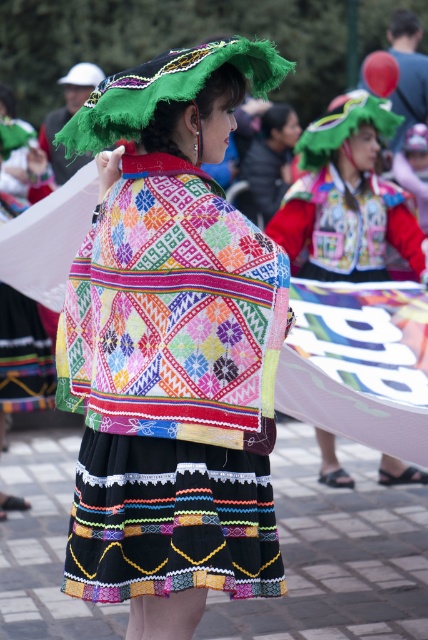
You are a photographer at the cultural event and want to capture the green fuzzy headdress at upper center in your shot. You are currently positioned at point (165,88). What direction should you move to frame the headdress properly?

The green fuzzy headdress at upper center is located at point (165,88), so you are already at the correct position to frame it properly.

You are a photographer standing at the origin point. You see two points in the scene, point (83,108) and point (272,172). Which point is closer to you?

Point (83,108) is in front of point (272,172), so it is closer to you.

You are a fashion designer observing the vibrant scene. You need to determine the spatial relationship between the embroidered fabric jacket at center and the green fuzzy headdress at upper center. Which object is positioned higher in the image?

The embroidered fabric jacket at center is taller than the green fuzzy headdress at upper center, so the jacket is positioned higher in the image.